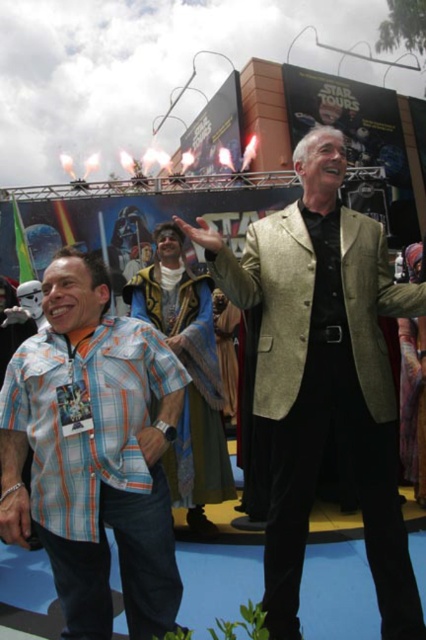
How much distance is there between plaid cotton shirt at left and velvet blue robe at center?

A distance of 28.26 feet exists between plaid cotton shirt at left and velvet blue robe at center.

Is point (186, 376) behind point (181, 461)?

No, (186, 376) is in front of (181, 461).

Describe the element at coordinates (86, 417) in the screenshot. I see `plaid cotton shirt at left` at that location.

You are a GUI agent. You are given a task and a screenshot of the screen. Output one action in this format:
    pyautogui.click(x=<x>, y=<y>)
    Task: Click on the plaid cotton shirt at left
    This screenshot has height=640, width=426.
    Given the screenshot: What is the action you would take?
    pyautogui.click(x=86, y=417)

Is gold textured coat at center taller than velvet blue robe at center?

Correct, gold textured coat at center is much taller as velvet blue robe at center.

Can you confirm if gold textured coat at center is bigger than velvet blue robe at center?

Correct, gold textured coat at center is larger in size than velvet blue robe at center.

At what (x,y) coordinates should I click in order to perform the action: click on gold textured coat at center. Please return your answer as a coordinate pair (x, y). The width and height of the screenshot is (426, 640). Looking at the image, I should click on (324, 376).

Which is in front, point (293, 420) or point (126, 321)?

Point (293, 420) is more forward.

Can you confirm if gold textured coat at center is wider than plaid cotton shirt at left?

Correct, the width of gold textured coat at center exceeds that of plaid cotton shirt at left.

Describe the element at coordinates (324, 376) in the screenshot. I see `gold textured coat at center` at that location.

Where is `gold textured coat at center`? The width and height of the screenshot is (426, 640). gold textured coat at center is located at coordinates (324, 376).